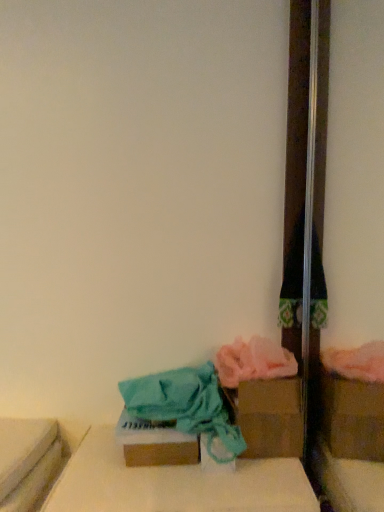
Where is `blank space to the left of brown cardboard box at lower center, acting as the 2th storage box starting from the right`? The height and width of the screenshot is (512, 384). blank space to the left of brown cardboard box at lower center, acting as the 2th storage box starting from the right is located at coordinates (96, 466).